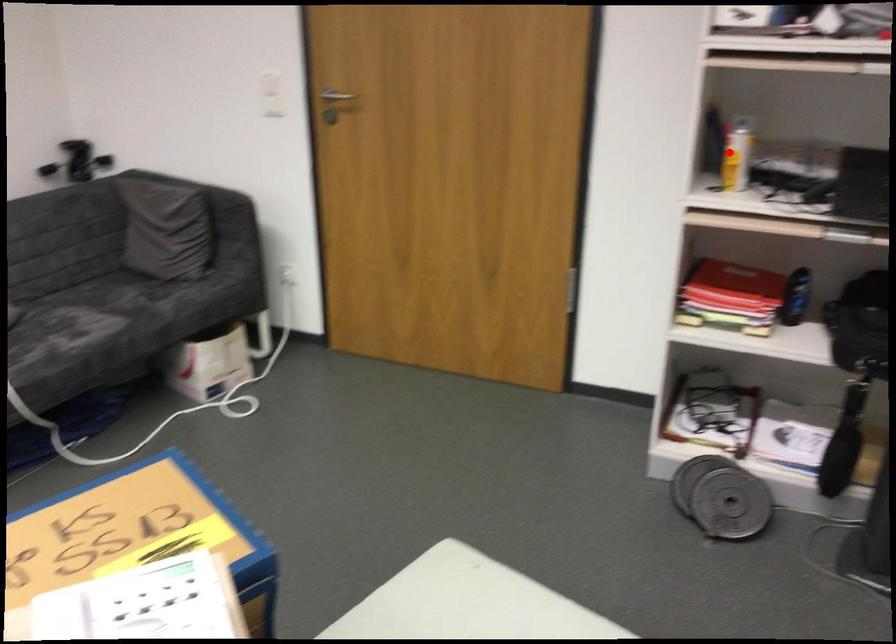
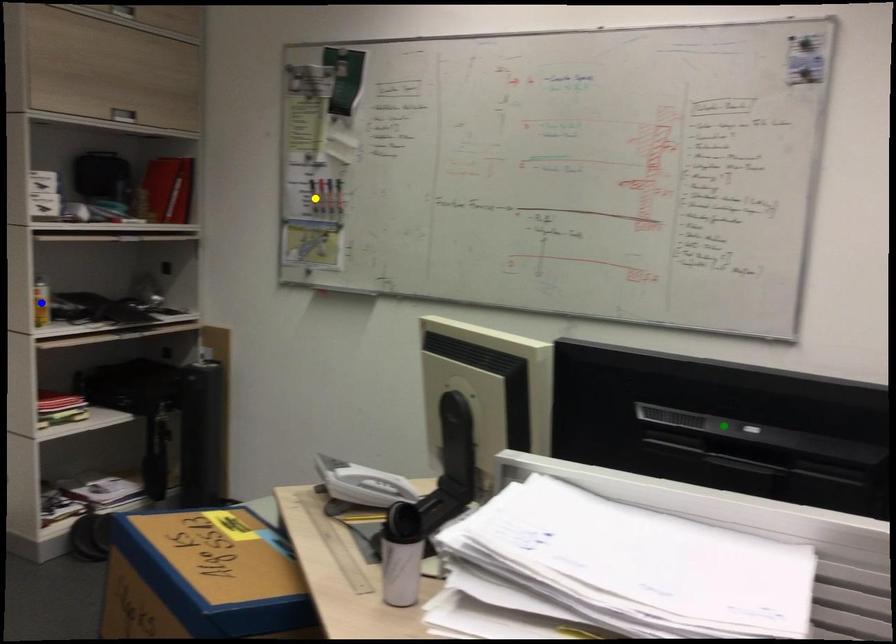
Question: I am providing you with two images of the same scene from different viewpoints. A red point is marked on the first image. You are given multiple points on the second image. Which point in image 2 represents the same 3d spot as the red point in image 1?

Choices:
 (A) green point
 (B) blue point
 (C) yellow point

Answer: (B)